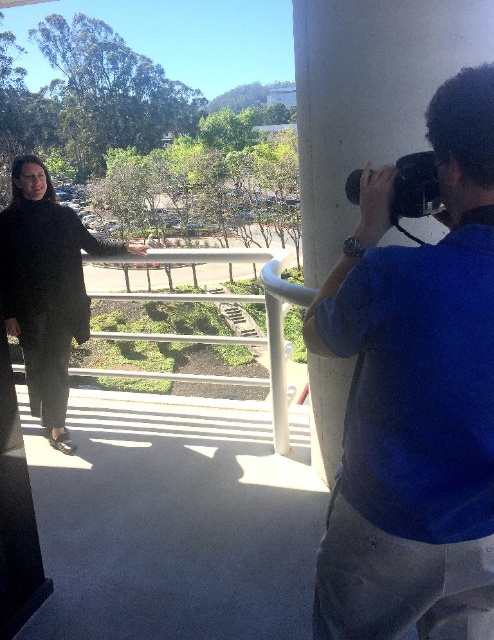
Consider the image. Between blue cotton shirt at right and black textured coat at left, which one appears on the left side from the viewer's perspective?

From the viewer's perspective, black textured coat at left appears more on the left side.

Consider the image. Can you confirm if blue cotton shirt at right is smaller than black textured coat at left?

Correct, blue cotton shirt at right occupies less space than black textured coat at left.

Identify the location of blue cotton shirt at right. (415, 397).

In order to click on blue cotton shirt at right in this screenshot , I will do `click(415, 397)`.

Which is above, black textured coat at left or black plastic camera at upper right?

black plastic camera at upper right

Between point (68, 296) and point (395, 225), which one is positioned in front?

Positioned in front is point (395, 225).

Find the location of a particular element. The width and height of the screenshot is (494, 640). black textured coat at left is located at coordinates (45, 289).

Based on the photo, does blue cotton shirt at right have a lesser width compared to black plastic camera at upper right?

In fact, blue cotton shirt at right might be wider than black plastic camera at upper right.

Between point (488, 337) and point (430, 152), which one is positioned behind?

Point (430, 152)

Where is `blue cotton shirt at right`? The height and width of the screenshot is (640, 494). blue cotton shirt at right is located at coordinates (415, 397).